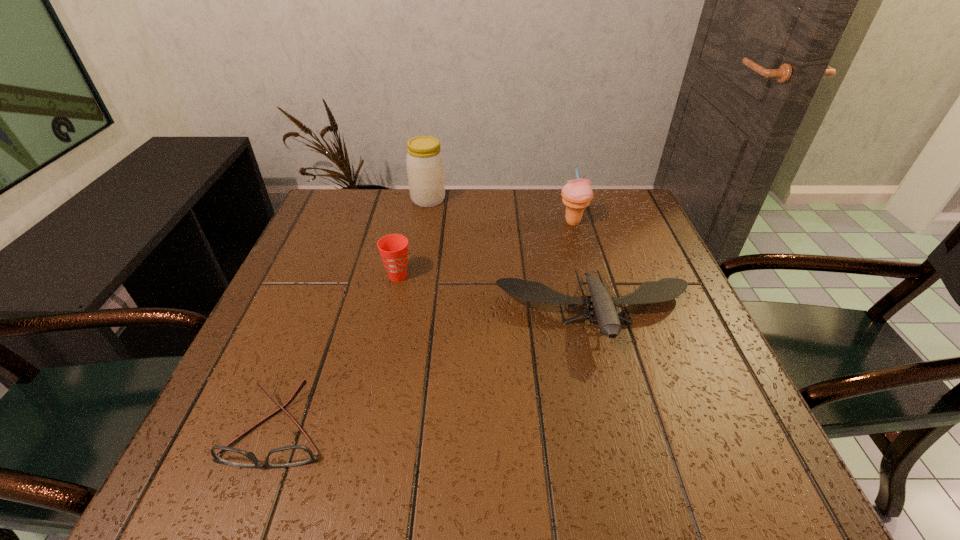
The image size is (960, 540). In order to click on vacant space at the near edge in this screenshot , I will do `click(557, 449)`.

In the image, there is a desktop. Where is `vacant space at the left edge`? vacant space at the left edge is located at coordinates (351, 275).

In the image, there is a desktop. Find the location of `vacant area at the right edge`. vacant area at the right edge is located at coordinates (665, 407).

The width and height of the screenshot is (960, 540). In the image, there is a desktop. What are the coordinates of `blank space at the far right corner` in the screenshot? It's located at (606, 212).

Locate an element on the screen. unoccupied position between the drone and the jar is located at coordinates (512, 256).

This screenshot has height=540, width=960. In order to click on free point between the drone and the jar in this screenshot , I will do `click(512, 256)`.

Locate an element on the screen. Image resolution: width=960 pixels, height=540 pixels. vacant area between the second farthest object and the fourth tallest object is located at coordinates (584, 268).

In order to click on vacant space in between the leftmost object and the third shortest object in this screenshot , I will do `click(339, 353)`.

Find the location of a particular element. vacant area between the third shortest object and the drone is located at coordinates (496, 295).

Identify the location of free space between the drone and the second tallest object. (584, 268).